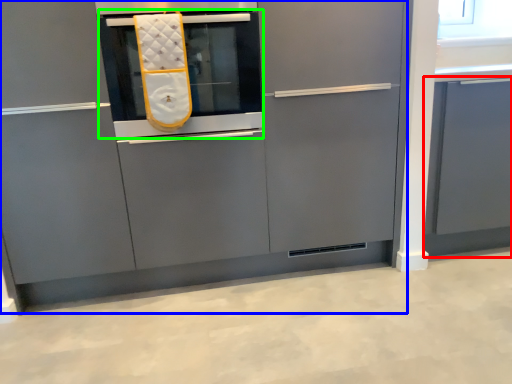
Question: Estimate the real-world distances between objects in this image. Which object is farther from cabinetry (highlighted by a red box), cabinetry (highlighted by a blue box) or oven (highlighted by a green box)?

Choices:
 (A) cabinetry
 (B) oven

Answer: (B)